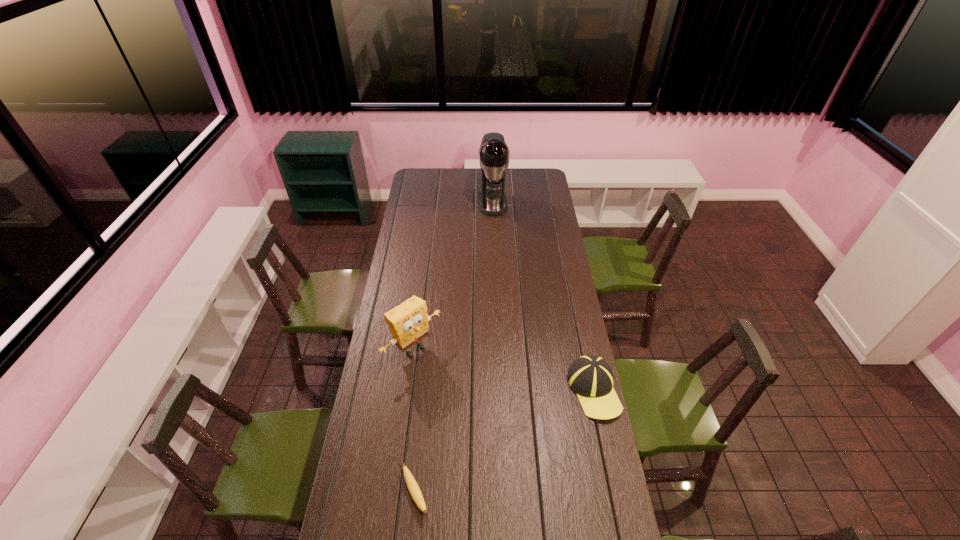
Where is `banana`? banana is located at coordinates point(412,485).

Where is `the shortest object`? The image size is (960, 540). the shortest object is located at coordinates (x=412, y=485).

This screenshot has height=540, width=960. Find the location of `the third tallest object`. the third tallest object is located at coordinates (590, 377).

Locate an element on the screen. This screenshot has height=540, width=960. baseball cap is located at coordinates (590, 377).

Find the location of a particular element. The image size is (960, 540). sponge is located at coordinates (408, 322).

Locate an element on the screen. The image size is (960, 540). coffee maker is located at coordinates (494, 153).

Where is `the third object from left to right`? This screenshot has height=540, width=960. the third object from left to right is located at coordinates (494, 153).

You are a GUI agent. You are given a task and a screenshot of the screen. Output one action in this format:
    pyautogui.click(x=<x>, y=<y>)
    Task: Click on the vacant space located 0.260m on the right of the banana
    Image resolution: width=960 pixels, height=540 pixels.
    Given the screenshot: What is the action you would take?
    pyautogui.click(x=508, y=493)

I want to click on vacant space located with the brim of the rightmost object facing forward, so click(609, 462).

Find the location of a particular element. free space located on the face of the third shortest object is located at coordinates (484, 415).